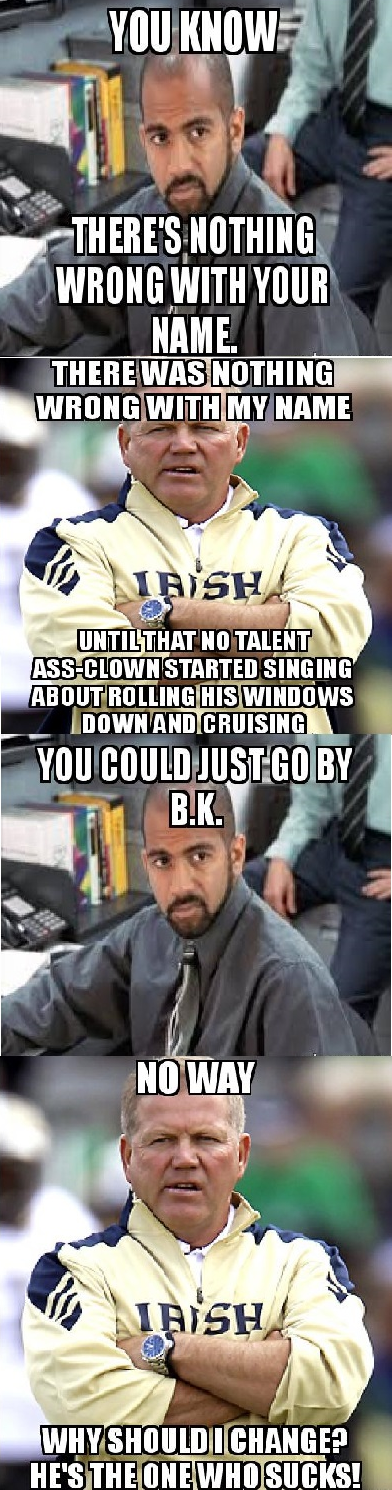
Locate an element on the screen. This screenshot has height=1490, width=392. landline phone is located at coordinates (35, 916), (33, 203).